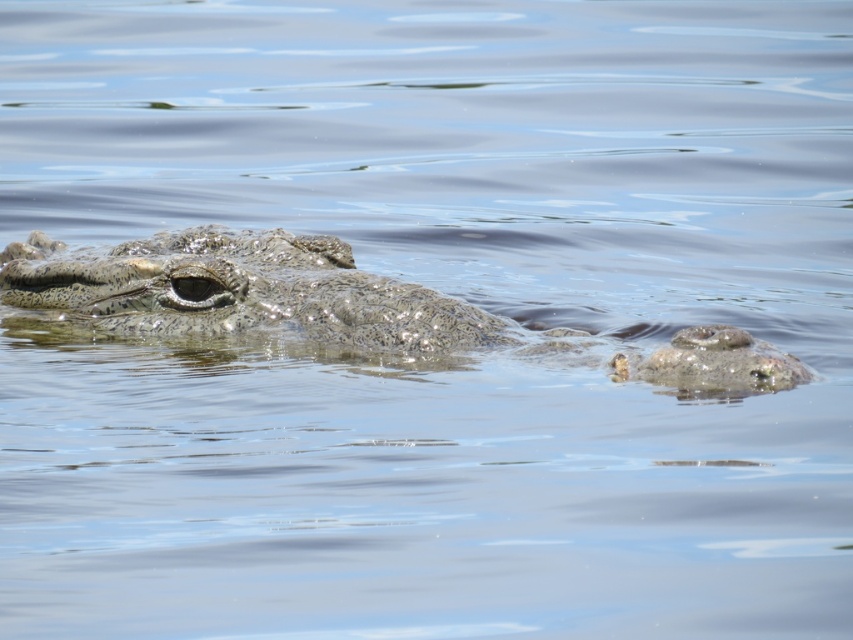
Question: Which of the following is the farthest from the observer?

Choices:
 (A) (103, 292)
 (B) (801, 368)

Answer: (A)

Question: Can you confirm if speckled scaly crocodile at center is positioned above gray textured rock at right?

Choices:
 (A) yes
 (B) no

Answer: (A)

Question: Which point appears closest to the camera in this image?

Choices:
 (A) (204, 253)
 (B) (720, 365)

Answer: (B)

Question: Can you confirm if speckled scaly crocodile at center is positioned above gray textured rock at right?

Choices:
 (A) no
 (B) yes

Answer: (B)

Question: Can you confirm if speckled scaly crocodile at center is positioned above gray textured rock at right?

Choices:
 (A) no
 (B) yes

Answer: (B)